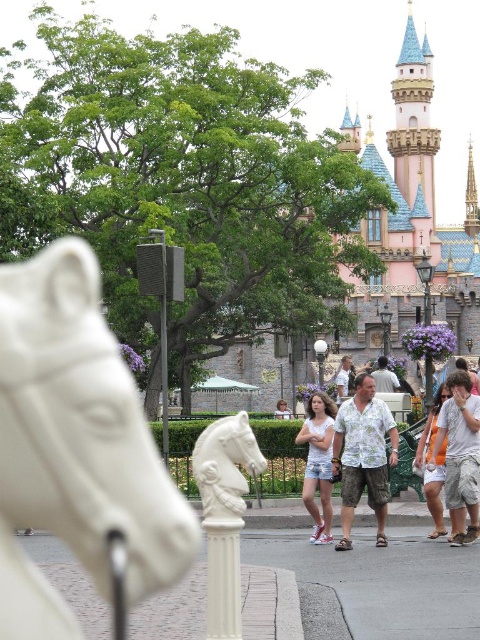
Question: Which of the following is the farthest from the observer?

Choices:
 (A) light brown hair at center
 (B) white cotton shirt at center

Answer: (A)

Question: Estimate the real-world distances between objects in this image. Which object is closer to the hawaiian print shirt at center?

Choices:
 (A) white marble horse head at center
 (B) white marble horse at center
 (C) white cotton shirt at center

Answer: (C)

Question: In this image, where is white cotton tank top at center located relative to light brown hair at center?

Choices:
 (A) left
 (B) right

Answer: (B)

Question: Can you confirm if white cotton shirt at center is positioned to the left of light brown hair at center?

Choices:
 (A) no
 (B) yes

Answer: (A)

Question: Is white cotton shirt at center behind white cotton shorts at lower right?

Choices:
 (A) no
 (B) yes

Answer: (A)

Question: Estimate the real-world distances between objects in this image. Which object is farther from the white cotton tank top at center?

Choices:
 (A) white cotton shorts at lower right
 (B) white cotton shirt at center

Answer: (B)